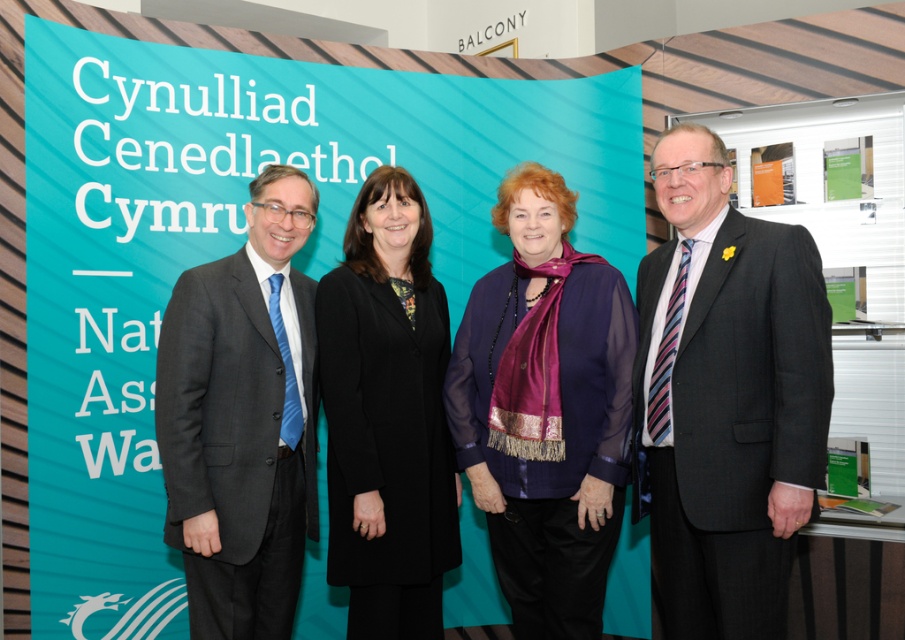
Between teal fabric banner at upper center and dark gray suit at right, which one appears on the right side from the viewer's perspective?

dark gray suit at right

Who is more distant from viewer, (x=100, y=376) or (x=669, y=600)?

Point (x=100, y=376)

The height and width of the screenshot is (640, 905). Identify the location of teal fabric banner at upper center. (235, 237).

What do you see at coordinates (725, 400) in the screenshot? I see `dark gray suit at right` at bounding box center [725, 400].

Does point (738, 340) lie behind point (344, 566)?

No, it is in front of (344, 566).

Describe the element at coordinates (725, 400) in the screenshot. I see `dark gray suit at right` at that location.

Where is `dark gray suit at right`? The width and height of the screenshot is (905, 640). dark gray suit at right is located at coordinates (725, 400).

Who is taller, purple silk scarf at center or dark gray suit at left?

With more height is purple silk scarf at center.

Consider the image. Is purple silk scarf at center to the left of dark gray suit at left from the viewer's perspective?

In fact, purple silk scarf at center is to the right of dark gray suit at left.

The image size is (905, 640). Identify the location of purple silk scarf at center. (545, 410).